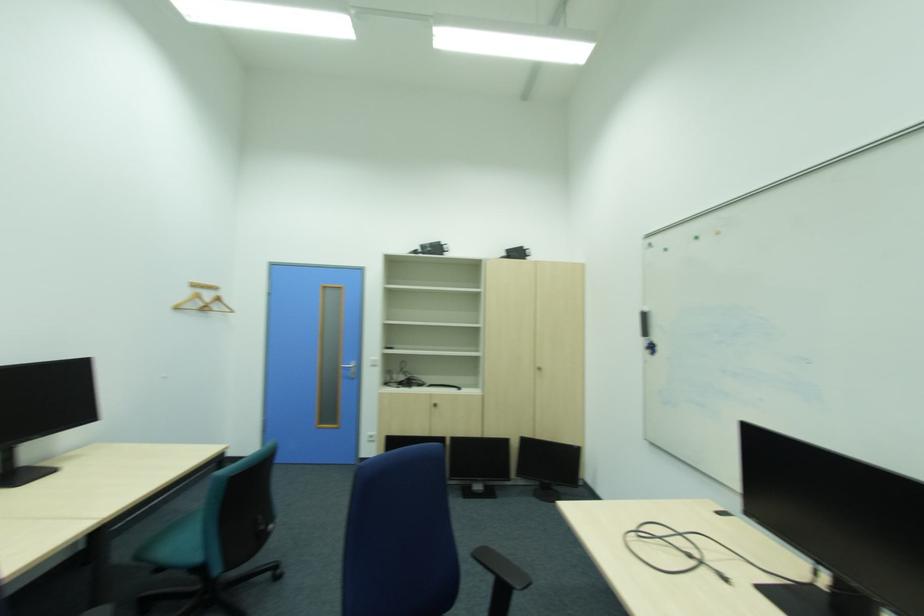
What do you see at coordinates (176, 544) in the screenshot? The height and width of the screenshot is (616, 924). I see `the chair sitting surface` at bounding box center [176, 544].